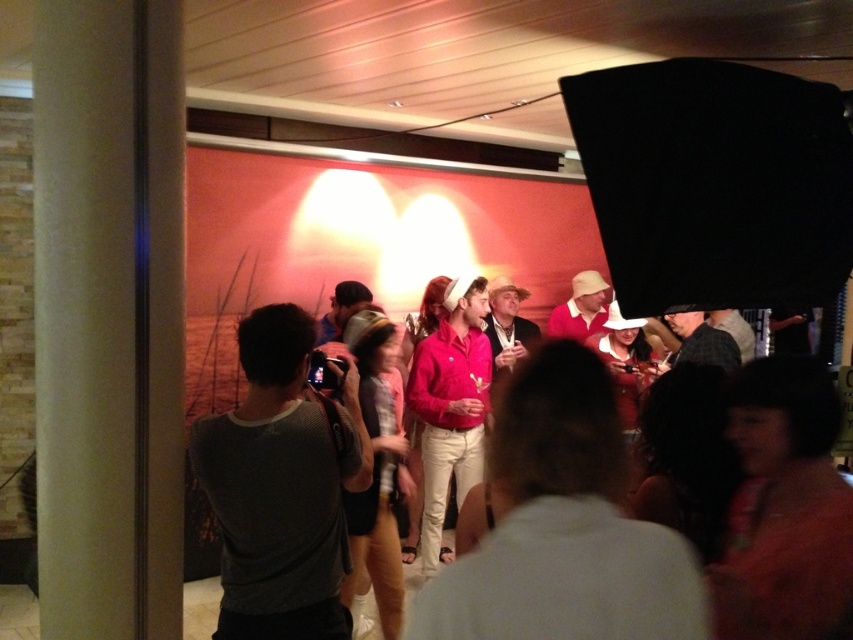
Is gray mesh shirt at left wider than matte pink shirt at center?

In fact, gray mesh shirt at left might be narrower than matte pink shirt at center.

At what (x,y) coordinates should I click in order to perform the action: click on gray mesh shirt at left. Please return your answer as a coordinate pair (x, y). This screenshot has height=640, width=853. Looking at the image, I should click on (281, 486).